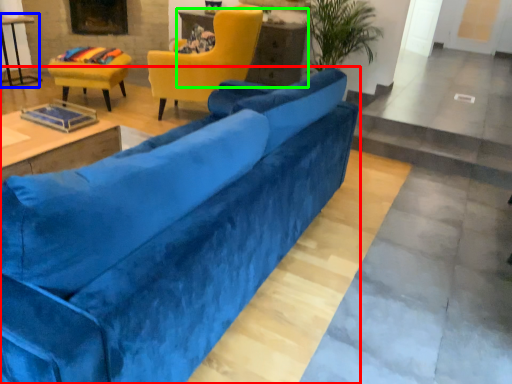
Question: Estimate the real-world distances between objects in this image. Which object is farther from studio couch (highlighted by a red box), table (highlighted by a blue box) or table (highlighted by a green box)?

Choices:
 (A) table
 (B) table

Answer: (A)